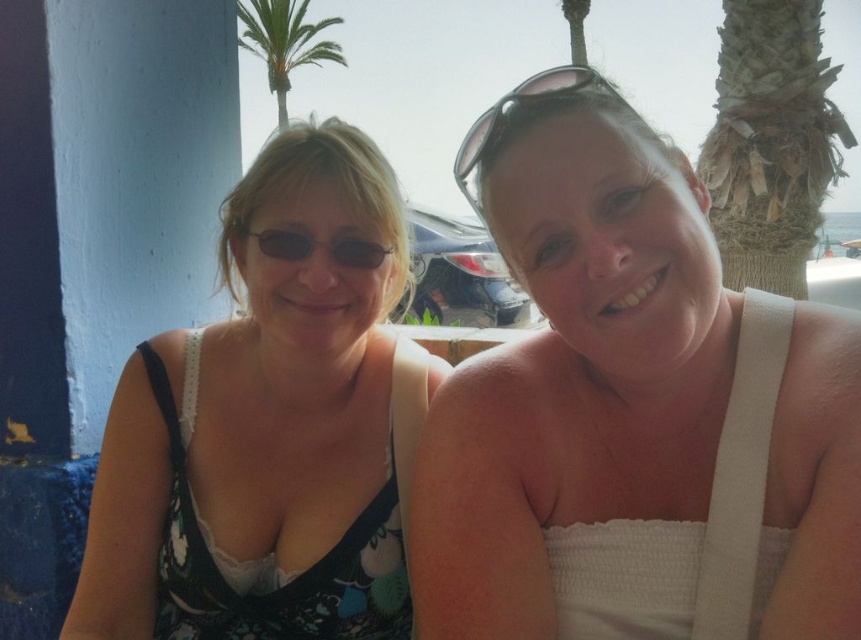
What are the coordinates of the white textured top at center?

The white textured top at center is located at point (x=632, y=410).

You are a photographer trying to capture a shot of the floral fabric dress at left and the green leafy palm tree at upper center. Which object is closer to the camera?

The floral fabric dress at left is positioned on the right side of green leafy palm tree at upper center, so it is closer to the camera than the palm tree.